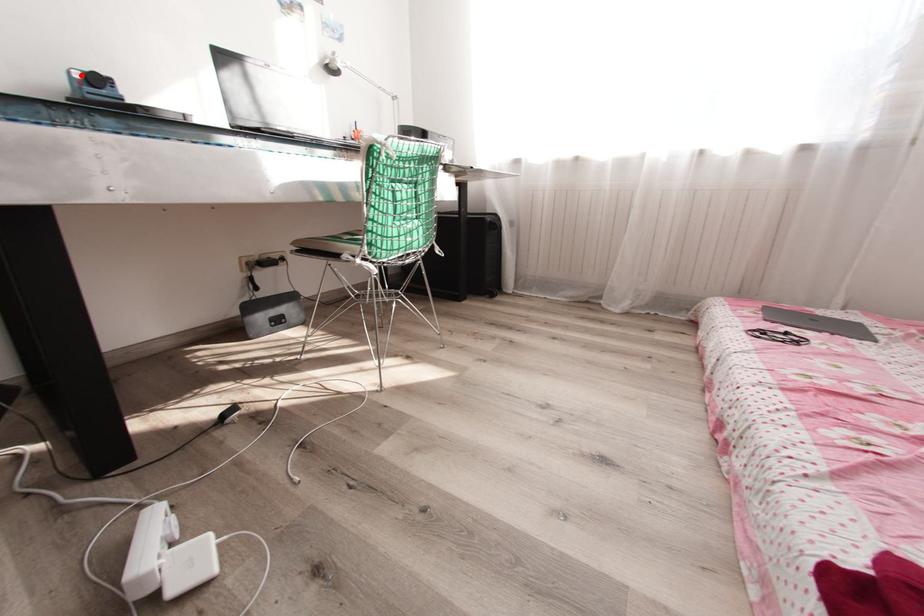
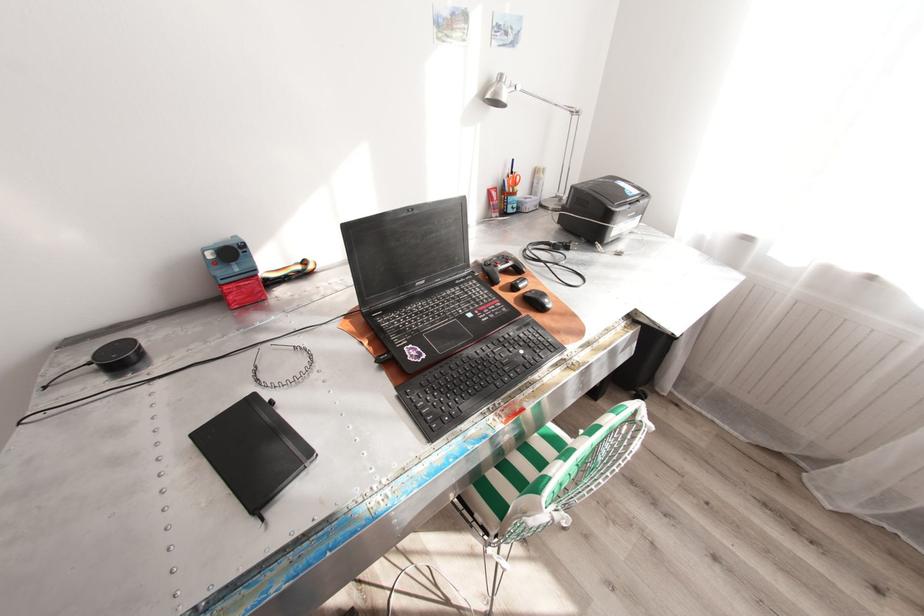
The point at the highlighted location is marked in the first image. Where is the corresponding point in the second image?

(215, 254)